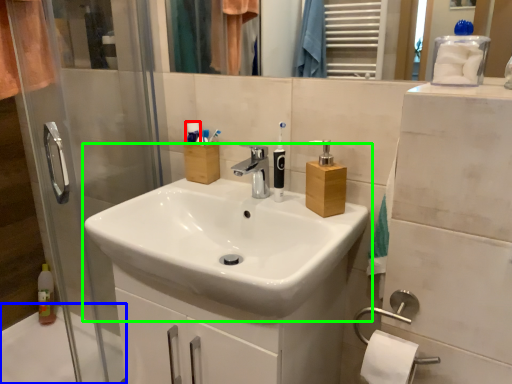
Question: Based on their relative distances, which object is nearer to toiletry (highlighted by a red box)? Choose from bath (highlighted by a blue box) and sink (highlighted by a green box).

Choices:
 (A) bath
 (B) sink

Answer: (B)